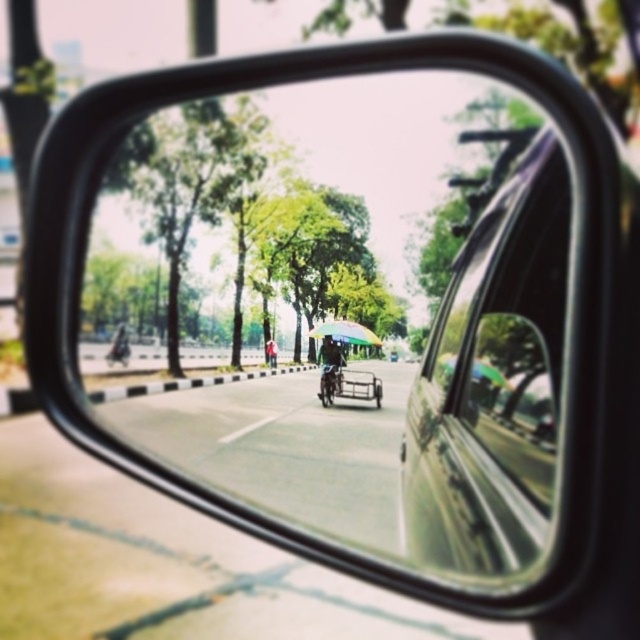
Between clear glass mirror at center and metallic silver car window at center-right, which one appears on the right side from the viewer's perspective?

Positioned to the right is metallic silver car window at center-right.

Is clear glass mirror at center positioned at the back of metallic silver car window at center-right?

Yes, it is.

Between point (506, 396) and point (528, 452), which one is positioned in front?

Positioned in front is point (528, 452).

Identify the location of clear glass mirror at center. This screenshot has height=640, width=640. (346, 307).

Is clear glass mirror at center thinner than green fabric umbrella at center?

No.

Does clear glass mirror at center have a greater width compared to green fabric umbrella at center?

Indeed, clear glass mirror at center has a greater width compared to green fabric umbrella at center.

Which is behind, point (547, 168) or point (269, 368)?

The point (269, 368) is behind.

Where is `clear glass mirror at center`? The height and width of the screenshot is (640, 640). clear glass mirror at center is located at coordinates (346, 307).

Between metallic silver bicycle at center and green fabric umbrella at center, which one is positioned lower?

green fabric umbrella at center is lower down.

The image size is (640, 640). Describe the element at coordinates (330, 364) in the screenshot. I see `metallic silver bicycle at center` at that location.

Is point (326, 378) more distant than point (268, 353)?

No, it is not.

Where is `metallic silver bicycle at center`? The image size is (640, 640). metallic silver bicycle at center is located at coordinates (330, 364).